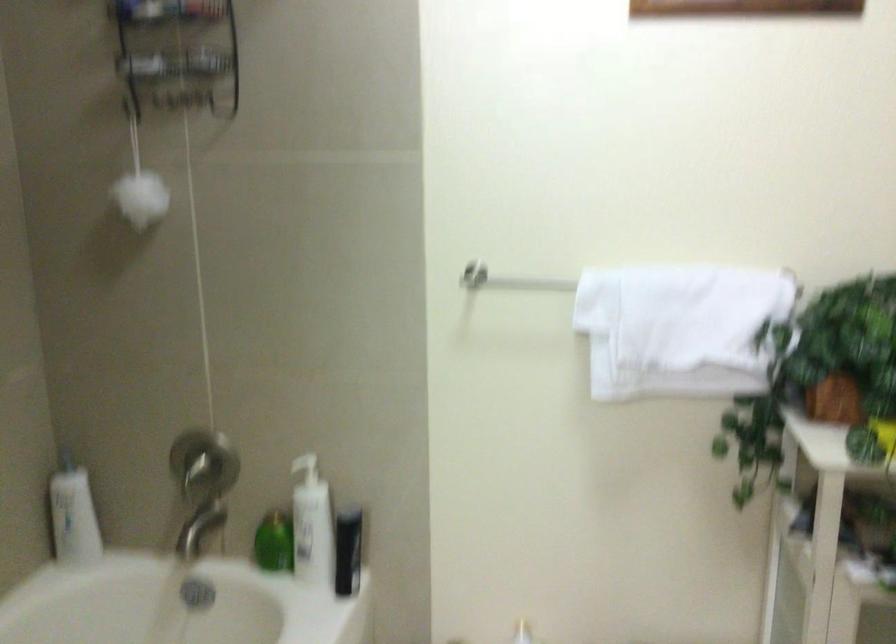
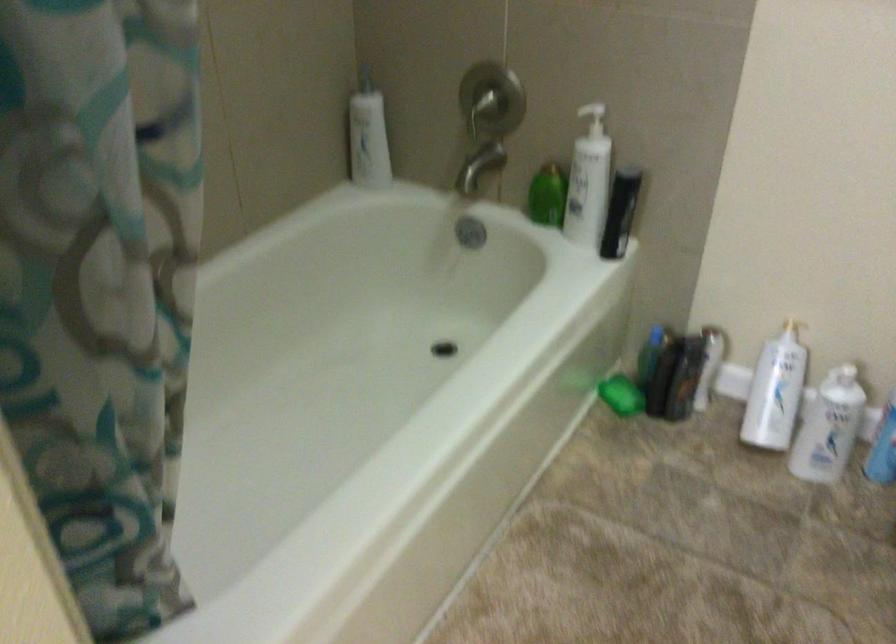
How did the camera likely rotate?

The rotation direction of the camera is left-down.